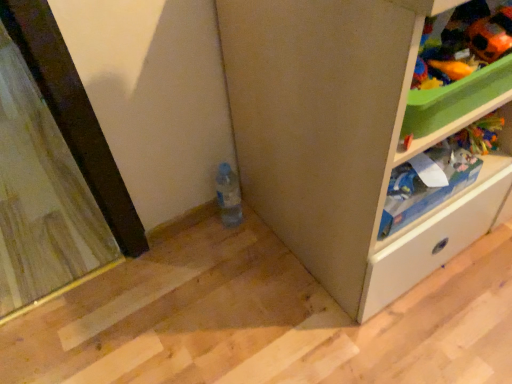
Question: Choose the correct answer: Is orange fabric toy at upper right, the 2th toy in the left-to-right sequence, inside white matte cabinet at lower right or outside it?

Choices:
 (A) outside
 (B) inside

Answer: (B)

Question: Considering the relative positions of orange fabric toy at upper right, acting as the 1th toy starting from the right, and white matte cabinet at lower right in the image provided, is orange fabric toy at upper right, acting as the 1th toy starting from the right, to the left or to the right of white matte cabinet at lower right?

Choices:
 (A) left
 (B) right

Answer: (A)

Question: Estimate the real-world distances between objects in this image. Which object is farther from the translucent plastic bottle at lower center?

Choices:
 (A) white matte cabinet at lower right
 (B) wooden screen door at left
 (C) orange fabric toy at upper right, acting as the 1th toy starting from the right
 (D) orange plush toy at upper right, the 2th toy when ordered from right to left
 (E) white plastic shelf at upper right

Answer: (B)

Question: Estimate the real-world distances between objects in this image. Which object is closer to the translucent plastic bottle at lower center?

Choices:
 (A) orange plush toy at upper right, acting as the first toy starting from the left
 (B) orange fabric toy at upper right, acting as the 1th toy starting from the right
 (C) white plastic shelf at upper right
 (D) white matte cabinet at lower right
 (E) wooden screen door at left

Answer: (D)